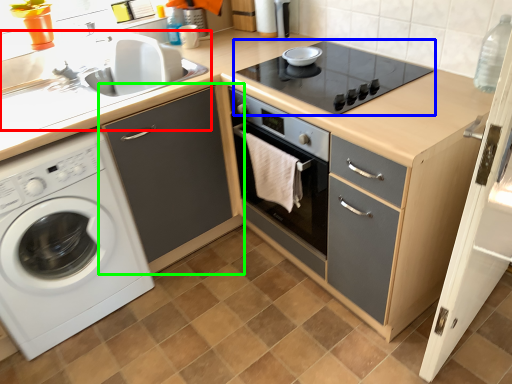
Question: Considering the real-world distances, which object is closest to sink (highlighted by a red box)? gas stove (highlighted by a blue box) or cabinetry (highlighted by a green box).

Choices:
 (A) gas stove
 (B) cabinetry

Answer: (B)